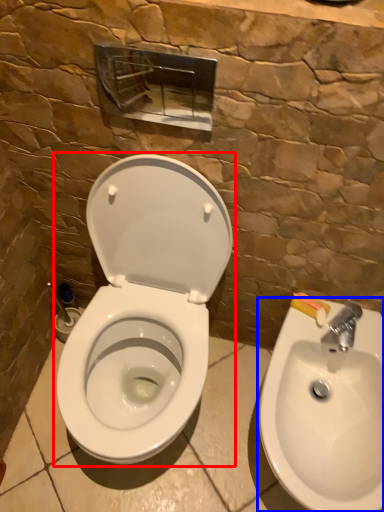
Question: Which object is further to the camera taking this photo, toilet (highlighted by a red box) or sink (highlighted by a blue box)?

Choices:
 (A) toilet
 (B) sink

Answer: (B)